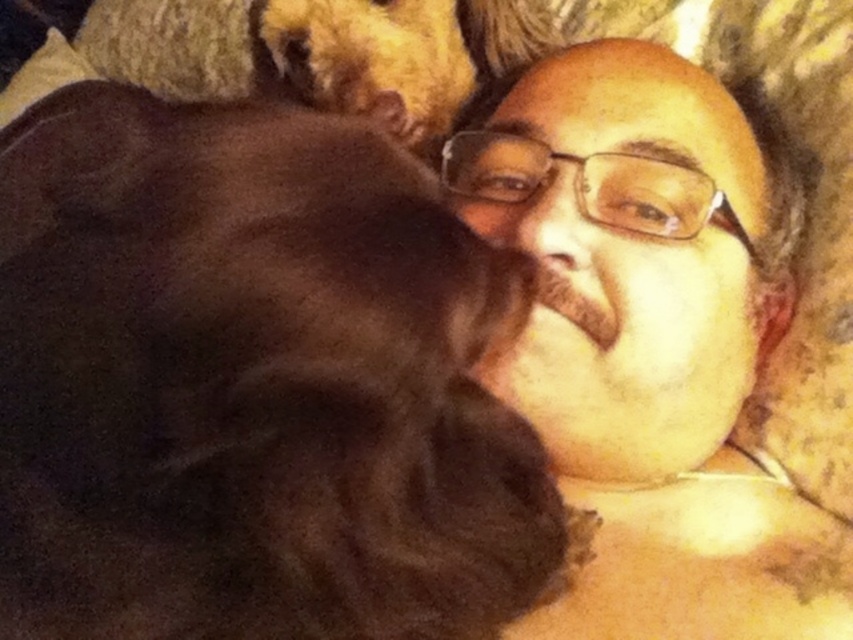
You are a veterinarian examining two dogs in a photo. The brown fur dog at center and the golden fur dog at upper center are both lying down. Which dog has a wider body?

The brown fur dog at center has a wider body than the golden fur dog at upper center because the brown fur dog at center is described as having a larger width.

In the scene shown: You are a photographer holding a camera with a 12 inch lens. You want to take a photo of the person lying down. The camera is positioned at point (387, 372). Can you get close enough to take the photo without moving the camera?

The distance between point (387, 372) and the viewer is 13.51 inches. Since the camera lens is 12 inches, you can get close enough to take the photo without moving the camera because the distance is greater than the lens length.

You are a photographer trying to capture a close portrait of the smooth skin face at center and the golden fur dog at upper center. Since the camera can only focus on one subject at a time, which subject should you choose to ensure the other is still in the frame but slightly blurred?

The smooth skin face at center has a larger size compared to the golden fur dog at upper center, so you should focus on the smooth skin face at center to keep it sharp while the golden fur dog at upper center will naturally be slightly blurred in the background.